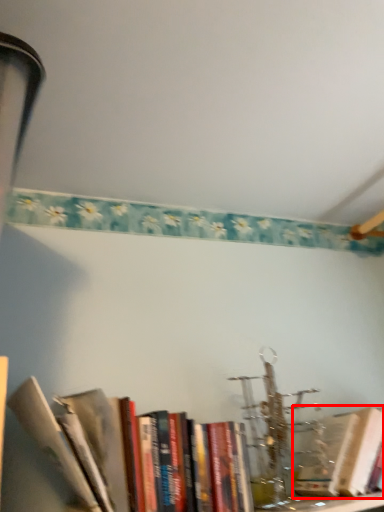
Question: From the image's perspective, where is book (annotated by the red box) located relative to book?

Choices:
 (A) above
 (B) below

Answer: (B)